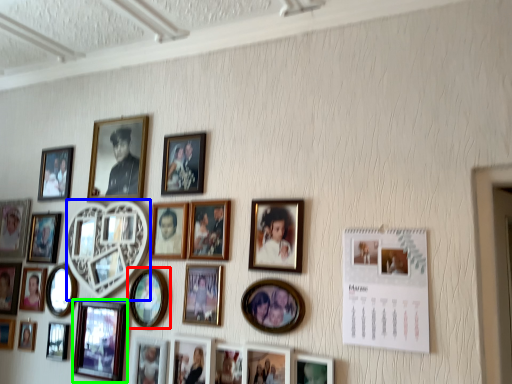
Question: Based on their relative distances, which object is nearer to picture frame (highlighted by a red box)? Choose from picture frame (highlighted by a blue box) and picture frame (highlighted by a green box).

Choices:
 (A) picture frame
 (B) picture frame

Answer: (B)